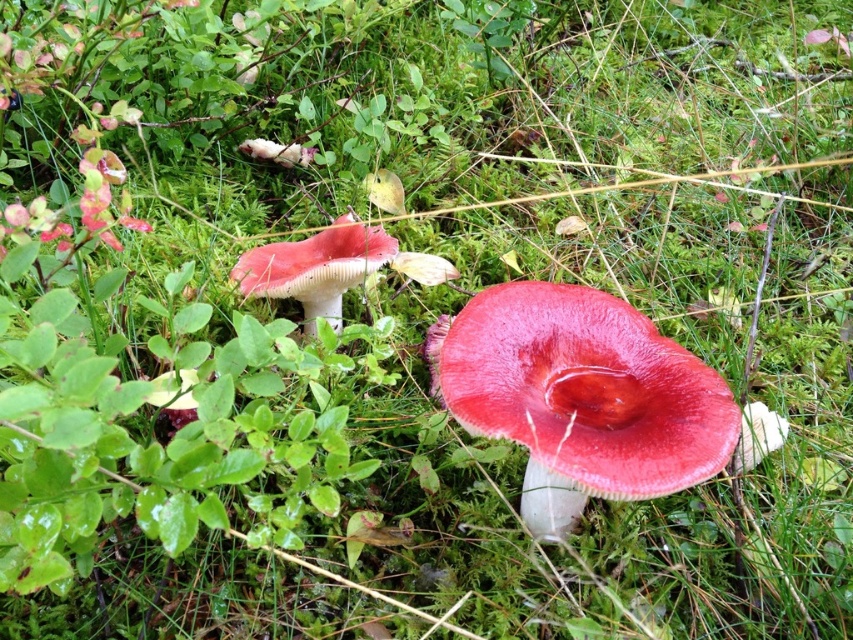
Question: Which point is closer to the camera taking this photo?

Choices:
 (A) (535, 486)
 (B) (291, 260)

Answer: (A)

Question: Is shiny red mushroom at center to the right of glossy red mushroom at center from the viewer's perspective?

Choices:
 (A) yes
 (B) no

Answer: (A)

Question: Can you confirm if shiny red mushroom at center is positioned to the left of glossy red mushroom at center?

Choices:
 (A) yes
 (B) no

Answer: (B)

Question: Is shiny red mushroom at center bigger than glossy red mushroom at center?

Choices:
 (A) yes
 (B) no

Answer: (A)

Question: Which object is closer to the camera taking this photo?

Choices:
 (A) shiny red mushroom at center
 (B) glossy red mushroom at center

Answer: (A)